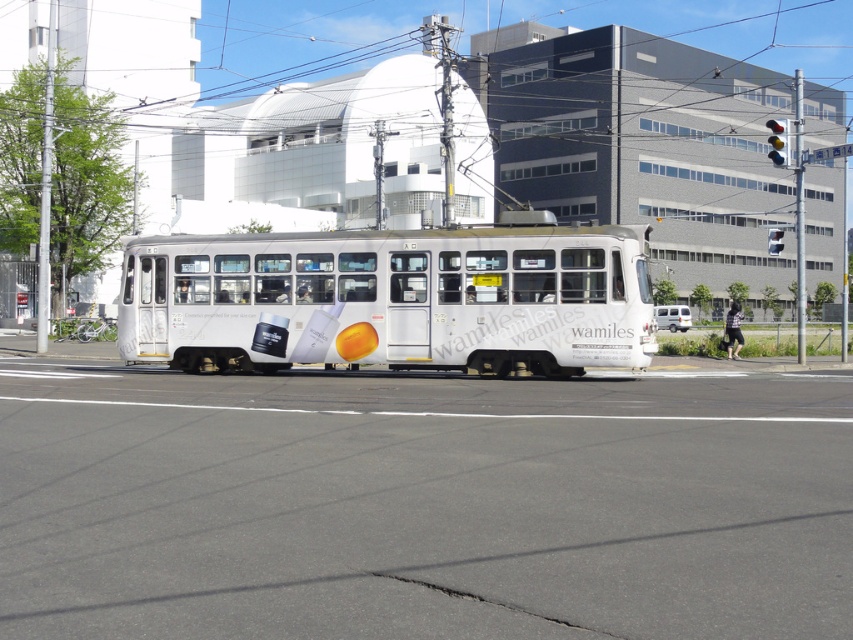
Between white glossy bus at center and white matte van at center, which one appears on the left side from the viewer's perspective?

white glossy bus at center

Who is shorter, white glossy bus at center or white matte van at center?

white matte van at center

This screenshot has height=640, width=853. Find the location of `white glossy bus at center`. white glossy bus at center is located at coordinates (392, 300).